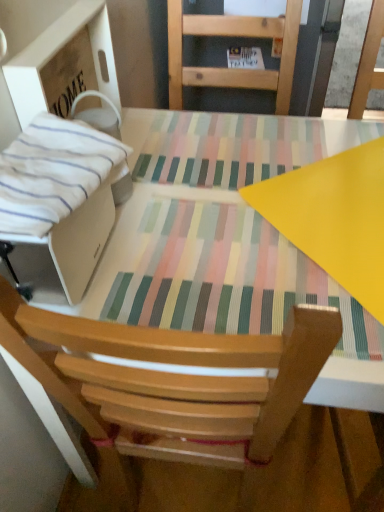
What are the coordinates of `vacant space situated above white cardboard box at left (from a real-world perspective)` in the screenshot? It's located at (54, 27).